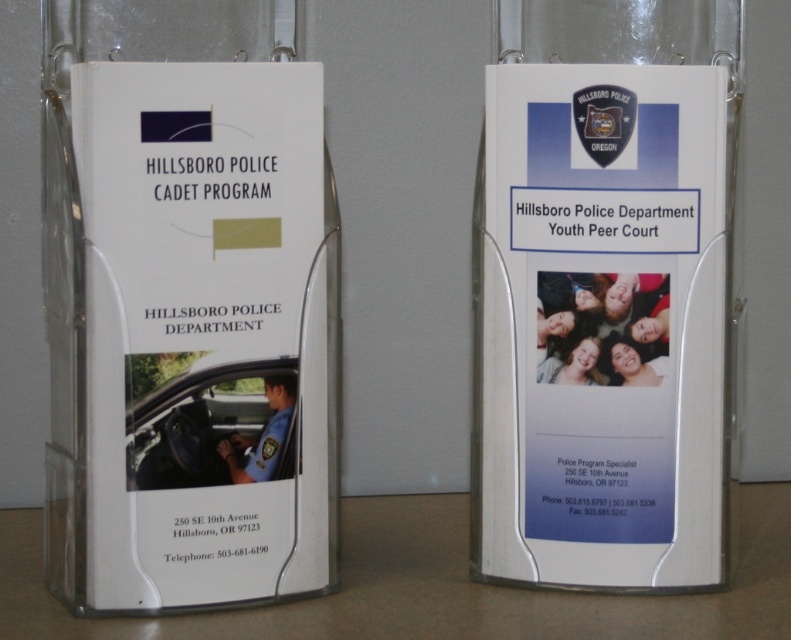
Question: Considering the relative positions of white plastic brochure at right and white plastic table at lower center in the image provided, where is white plastic brochure at right located with respect to white plastic table at lower center?

Choices:
 (A) above
 (B) below

Answer: (A)

Question: Is white plastic brochure at right positioned at the back of white plastic table at lower center?

Choices:
 (A) no
 (B) yes

Answer: (B)

Question: Is white plastic brochure at right wider than white plastic table at lower center?

Choices:
 (A) no
 (B) yes

Answer: (A)

Question: Which point is closer to the camera taking this photo?

Choices:
 (A) (562, 632)
 (B) (481, 244)

Answer: (A)